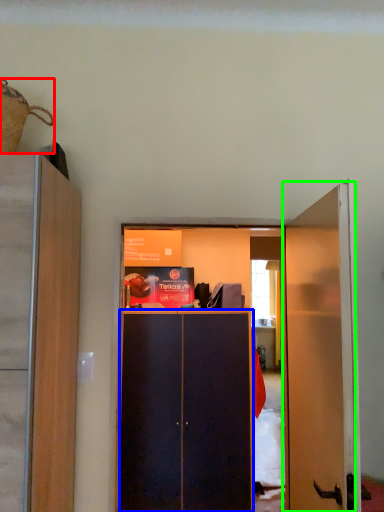
Question: Which object is the closest to the houseplant (highlighted by a red box)? Choose among these: screen door (highlighted by a blue box) or door (highlighted by a green box).

Choices:
 (A) screen door
 (B) door

Answer: (B)